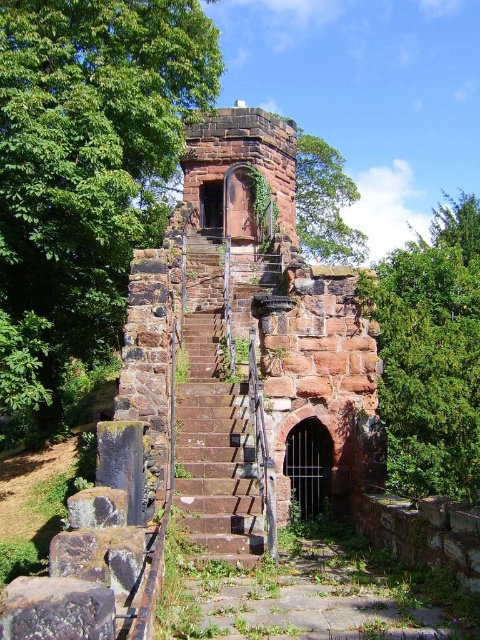
You are standing at the entrance of the old stone structure and want to go to the point marked by coordinates. Which coordinate point, point [55,252] or point [186,252], is closer to you?

Point [55,252] is in front of point [186,252], so it is closer to you.